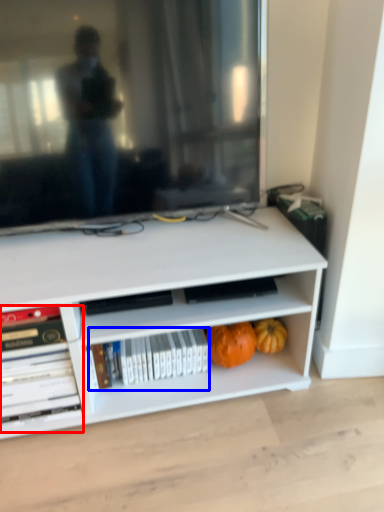
Question: Which of the following is the closest to the observer, book (highlighted by a red box) or book (highlighted by a blue box)?

Choices:
 (A) book
 (B) book

Answer: (A)